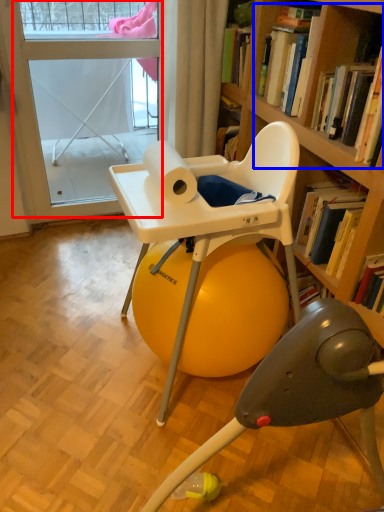
Question: Among these objects, which one is nearest to the camera, screen door (highlighted by a red box) or book (highlighted by a blue box)?

Choices:
 (A) screen door
 (B) book

Answer: (B)